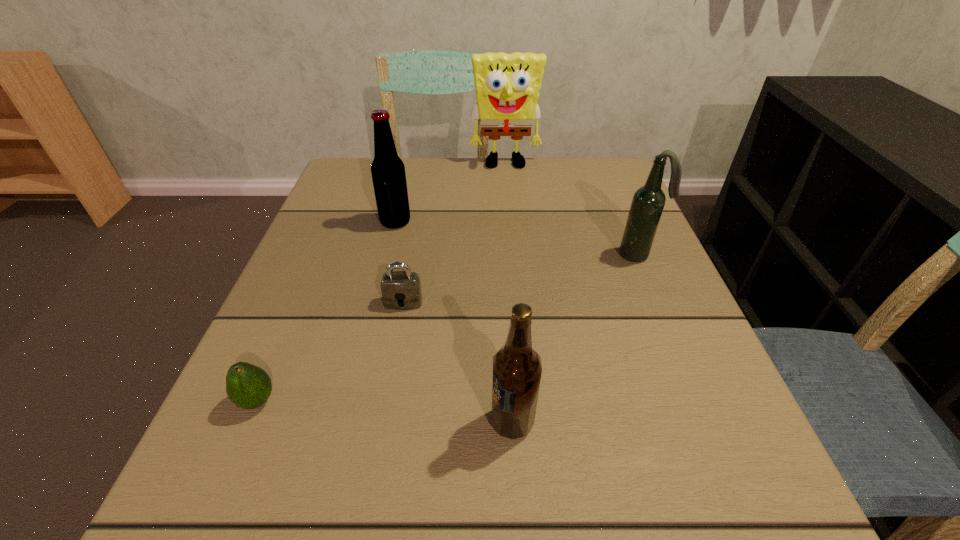
At what (x,y) coordinates should I click in order to perform the action: click on free region located on the left of the rightmost object. Please return your answer as a coordinate pair (x, y). This screenshot has height=540, width=960. Looking at the image, I should click on (585, 254).

Find the location of a particular element. vacant space located on the label of the second beer bottle from right to left is located at coordinates (290, 422).

Identify the location of vacant space located on the label of the second beer bottle from right to left. This screenshot has width=960, height=540. (333, 422).

Image resolution: width=960 pixels, height=540 pixels. Find the location of `vacant area located on the label of the second beer bottle from right to left`. vacant area located on the label of the second beer bottle from right to left is located at coordinates (253, 422).

This screenshot has height=540, width=960. What are the coordinates of `vacant position located 0.080m at the front of the padlock near the keyhole` in the screenshot? It's located at (396, 346).

I want to click on vacant space situated 0.200m on the back of the leftmost object, so click(304, 292).

I want to click on object that is at the far edge, so click(507, 86).

The height and width of the screenshot is (540, 960). Find the location of `beer bottle positioned at the left edge`. beer bottle positioned at the left edge is located at coordinates (388, 173).

This screenshot has height=540, width=960. I want to click on avocado situated at the left edge, so click(247, 386).

Find the location of a particular element. object that is at the right edge is located at coordinates (648, 202).